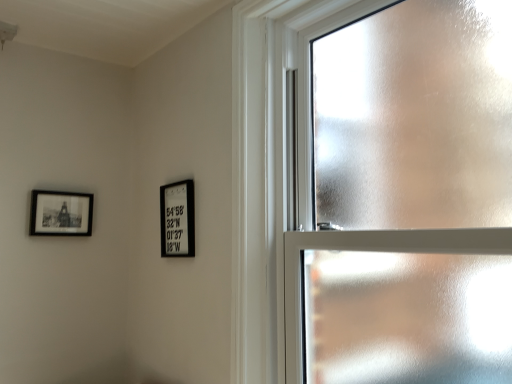
Identify the location of black matte picture frame at center, the first picture frame viewed from the right. The width and height of the screenshot is (512, 384). (177, 219).

At what (x,y) coordinates should I click in order to perform the action: click on frosted glass window at upper right. Please return your answer as a coordinate pair (x, y). Looking at the image, I should click on (382, 191).

How different are the orientations of frosted glass window at upper right and matte black picture frame at upper left, placed as the 2th picture frame when sorted from right to left, in degrees?

frosted glass window at upper right and matte black picture frame at upper left, placed as the 2th picture frame when sorted from right to left, are facing 88.3 degrees away from each other.

Between point (482, 8) and point (56, 232), which one is positioned behind?

Point (56, 232)

Which of these two, frosted glass window at upper right or matte black picture frame at upper left, placed as the 2th picture frame when sorted from right to left, is bigger?

frosted glass window at upper right.

Is matte black picture frame at upper left, placed as the 2th picture frame when sorted from right to left, at the back of frosted glass window at upper right?

frosted glass window at upper right is not turned away from matte black picture frame at upper left, placed as the 2th picture frame when sorted from right to left.

Does black matte picture frame at center, the second picture frame in the left-to-right sequence, have a larger size compared to matte black picture frame at upper left, placed as the first picture frame when sorted from left to right?

Yes, black matte picture frame at center, the second picture frame in the left-to-right sequence, is bigger than matte black picture frame at upper left, placed as the first picture frame when sorted from left to right.

In terms of height, does black matte picture frame at center, the second picture frame in the left-to-right sequence, look taller or shorter compared to matte black picture frame at upper left, placed as the first picture frame when sorted from left to right?

Clearly, black matte picture frame at center, the second picture frame in the left-to-right sequence, is taller compared to matte black picture frame at upper left, placed as the first picture frame when sorted from left to right.

Is black matte picture frame at center, the second picture frame in the left-to-right sequence, not near matte black picture frame at upper left, placed as the 2th picture frame when sorted from right to left?

No, there isn't a large distance between black matte picture frame at center, the second picture frame in the left-to-right sequence, and matte black picture frame at upper left, placed as the 2th picture frame when sorted from right to left.

Is black matte picture frame at center, the first picture frame viewed from the right, closer to camera compared to matte black picture frame at upper left, placed as the first picture frame when sorted from left to right?

That is True.

The height and width of the screenshot is (384, 512). Find the location of `picture frame that is on the left side of black matte picture frame at center, the first picture frame viewed from the right`. picture frame that is on the left side of black matte picture frame at center, the first picture frame viewed from the right is located at coordinates (61, 213).

Is matte black picture frame at upper left, placed as the first picture frame when sorted from left to right, to the left of black matte picture frame at center, the first picture frame viewed from the right, from the viewer's perspective?

Yes, matte black picture frame at upper left, placed as the first picture frame when sorted from left to right, is to the left of black matte picture frame at center, the first picture frame viewed from the right.

Is matte black picture frame at upper left, placed as the 2th picture frame when sorted from right to left, further to the viewer compared to black matte picture frame at center, the second picture frame in the left-to-right sequence?

Yes, matte black picture frame at upper left, placed as the 2th picture frame when sorted from right to left, is further from the viewer.

From a real-world perspective, is matte black picture frame at upper left, placed as the 2th picture frame when sorted from right to left, beneath frosted glass window at upper right?

Correct, in the physical world, matte black picture frame at upper left, placed as the 2th picture frame when sorted from right to left, is lower than frosted glass window at upper right.

Based on their positions, is matte black picture frame at upper left, placed as the 2th picture frame when sorted from right to left, located to the left or right of frosted glass window at upper right?

matte black picture frame at upper left, placed as the 2th picture frame when sorted from right to left, is positioned on frosted glass window at upper right's left side.

Is matte black picture frame at upper left, placed as the 2th picture frame when sorted from right to left, directly adjacent to frosted glass window at upper right?

There is a gap between matte black picture frame at upper left, placed as the 2th picture frame when sorted from right to left, and frosted glass window at upper right.

Based on the photo, between matte black picture frame at upper left, placed as the first picture frame when sorted from left to right, and frosted glass window at upper right, which one has larger size?

With larger size is frosted glass window at upper right.

In terms of size, does frosted glass window at upper right appear bigger or smaller than black matte picture frame at center, the second picture frame in the left-to-right sequence?

Clearly, frosted glass window at upper right is larger in size than black matte picture frame at center, the second picture frame in the left-to-right sequence.

Consider the image. From the image's perspective, is frosted glass window at upper right above or below black matte picture frame at center, the first picture frame viewed from the right?

frosted glass window at upper right is situated higher than black matte picture frame at center, the first picture frame viewed from the right, in the image.

Which is behind, point (499, 234) or point (187, 200)?

The point (187, 200) is behind.

Is frosted glass window at upper right turned away from black matte picture frame at center, the second picture frame in the left-to-right sequence?

No, black matte picture frame at center, the second picture frame in the left-to-right sequence, is not at the back of frosted glass window at upper right.

In order to click on the 1st picture frame counting from the left of the frosted glass window at upper right in this screenshot , I will do `click(177, 219)`.

Does black matte picture frame at center, the second picture frame in the left-to-right sequence, have a lesser height compared to frosted glass window at upper right?

Yes.

Which object is wider, black matte picture frame at center, the first picture frame viewed from the right, or frosted glass window at upper right?

With larger width is frosted glass window at upper right.

Can we say black matte picture frame at center, the second picture frame in the left-to-right sequence, lies outside frosted glass window at upper right?

Yes, black matte picture frame at center, the second picture frame in the left-to-right sequence, is located beyond the bounds of frosted glass window at upper right.

Identify the location of picture frame that is the 2nd one when counting leftward from the frosted glass window at upper right. This screenshot has height=384, width=512. (61, 213).

Image resolution: width=512 pixels, height=384 pixels. I want to click on picture frame above the black matte picture frame at center, the second picture frame in the left-to-right sequence (from the image's perspective), so click(x=61, y=213).

When comparing their distances from matte black picture frame at upper left, placed as the 2th picture frame when sorted from right to left, does frosted glass window at upper right or black matte picture frame at center, the first picture frame viewed from the right, seem closer?

black matte picture frame at center, the first picture frame viewed from the right, is positioned closer to the anchor matte black picture frame at upper left, placed as the 2th picture frame when sorted from right to left.

Looking at the image, which one is located closer to frosted glass window at upper right, black matte picture frame at center, the second picture frame in the left-to-right sequence, or matte black picture frame at upper left, placed as the first picture frame when sorted from left to right?

Based on the image, black matte picture frame at center, the second picture frame in the left-to-right sequence, appears to be nearer to frosted glass window at upper right.

Looking at the image, which one is located further to matte black picture frame at upper left, placed as the 2th picture frame when sorted from right to left, black matte picture frame at center, the first picture frame viewed from the right, or frosted glass window at upper right?

frosted glass window at upper right is further to matte black picture frame at upper left, placed as the 2th picture frame when sorted from right to left.

From the image, which object appears to be nearer to black matte picture frame at center, the second picture frame in the left-to-right sequence, matte black picture frame at upper left, placed as the first picture frame when sorted from left to right, or frosted glass window at upper right?

matte black picture frame at upper left, placed as the first picture frame when sorted from left to right, lies closer to black matte picture frame at center, the second picture frame in the left-to-right sequence, than the other object.

Based on their spatial positions, is matte black picture frame at upper left, placed as the 2th picture frame when sorted from right to left, or black matte picture frame at center, the first picture frame viewed from the right, further from frosted glass window at upper right?

matte black picture frame at upper left, placed as the 2th picture frame when sorted from right to left, is positioned further to the anchor frosted glass window at upper right.

When comparing their distances from black matte picture frame at center, the first picture frame viewed from the right, does frosted glass window at upper right or matte black picture frame at upper left, placed as the 2th picture frame when sorted from right to left, seem further?

frosted glass window at upper right is positioned further to the anchor black matte picture frame at center, the first picture frame viewed from the right.

I want to click on picture frame between frosted glass window at upper right and matte black picture frame at upper left, placed as the 2th picture frame when sorted from right to left, in the front-back direction, so click(177, 219).